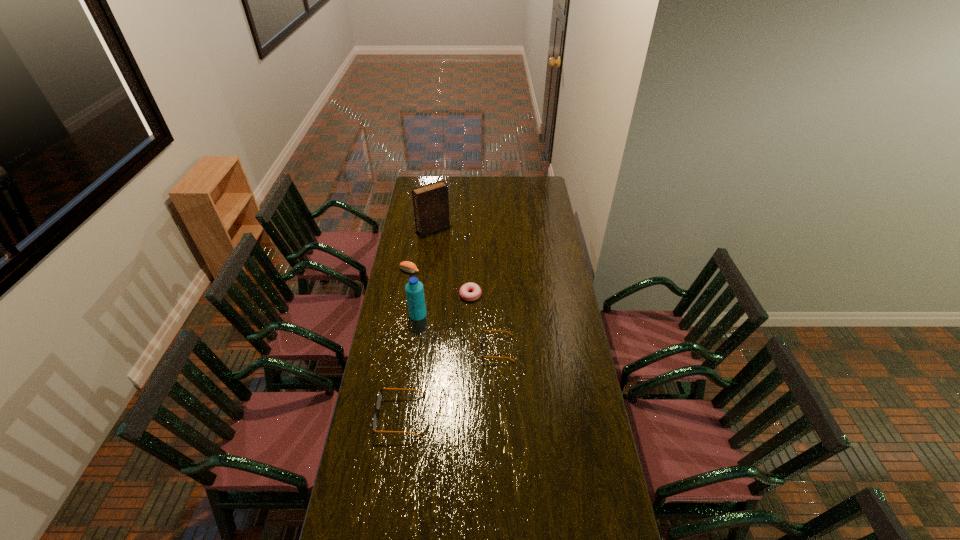
This screenshot has height=540, width=960. What are the coordinates of `the taller spectacles` in the screenshot? It's located at (379, 397).

This screenshot has height=540, width=960. What are the coordinates of `the left spectacles` in the screenshot? It's located at (379, 397).

The height and width of the screenshot is (540, 960). What are the coordinates of `the shorter spectacles` in the screenshot? It's located at (481, 336).

Locate an element on the screen. This screenshot has height=540, width=960. the farther spectacles is located at coordinates (481, 336).

The height and width of the screenshot is (540, 960). Find the location of `the fourth nearest object`. the fourth nearest object is located at coordinates (463, 291).

At what (x,y) coordinates should I click in order to perform the action: click on Bible. Please return your answer as a coordinate pair (x, y). Looking at the image, I should click on (431, 202).

The width and height of the screenshot is (960, 540). I want to click on the tallest object, so (431, 202).

This screenshot has height=540, width=960. In order to click on the fourth farthest object in this screenshot , I will do pos(414,289).

Where is `water bottle`? The image size is (960, 540). water bottle is located at coordinates (414, 289).

Identify the location of the fifth nearest object. (406, 266).